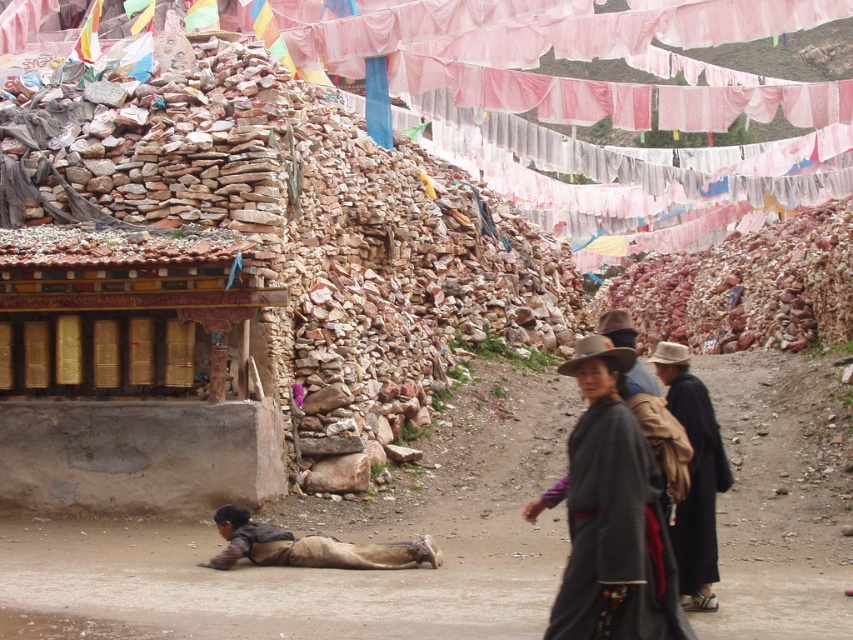
Question: Which point is farther to the camera?

Choices:
 (A) brown felt cowboy hat at center
 (B) black woolen robe at lower right
 (C) brown felt hat at center

Answer: (C)

Question: Does gold metallic prayer wheel at lower left have a larger size compared to black woolen robe at lower right?

Choices:
 (A) no
 (B) yes

Answer: (B)

Question: Which of these objects is positioned farthest from the black woolen robe at lower right?

Choices:
 (A) brown felt cowboy hat at center
 (B) dark gray woolen robe at center
 (C) brown leather pants at lower center
 (D) gold metallic prayer wheel at lower left

Answer: (D)

Question: Can you confirm if black woolen robe at lower right is positioned below brown felt cowboy hat at center?

Choices:
 (A) no
 (B) yes

Answer: (B)

Question: Which point is closer to the camera taking this photo?

Choices:
 (A) (590, 604)
 (B) (653, 355)

Answer: (A)

Question: Observing the image, what is the correct spatial positioning of dark gray woolen robe at center in reference to brown leather pants at lower center?

Choices:
 (A) below
 (B) above

Answer: (B)